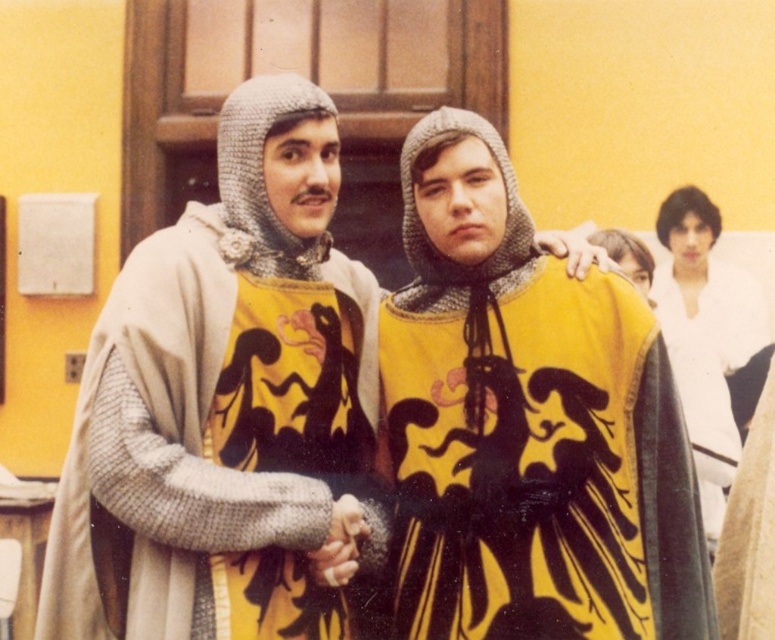
Question: Which of the following is the farthest from the observer?

Choices:
 (A) yellow fabric cape at center
 (B) white matte shirt at upper right
 (C) knitted wool robe at center

Answer: (B)

Question: Is yellow fabric cape at center smaller than white matte shirt at upper right?

Choices:
 (A) yes
 (B) no

Answer: (A)

Question: Which object is closer to the camera taking this photo?

Choices:
 (A) yellow fabric cape at center
 (B) white matte shirt at upper right

Answer: (A)

Question: Can you confirm if yellow fabric cape at center is positioned to the right of knitted wool robe at center?

Choices:
 (A) no
 (B) yes

Answer: (B)

Question: Is knitted wool robe at center smaller than white matte shirt at upper right?

Choices:
 (A) no
 (B) yes

Answer: (B)

Question: Which object is the farthest from the yellow fabric cape at center?

Choices:
 (A) knitted wool robe at center
 (B) white matte shirt at upper right

Answer: (B)